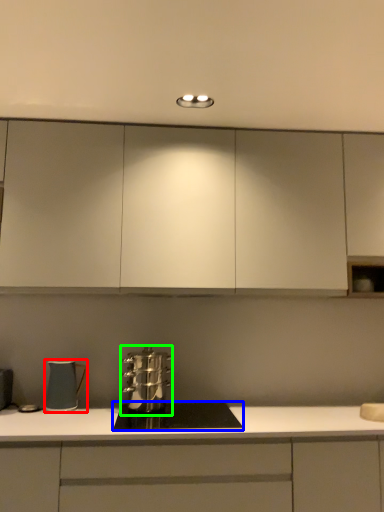
Question: Based on their relative distances, which object is nearer to kitchen appliance (highlighted by a red box)? Choose from home appliance (highlighted by a blue box) and kitchen appliance (highlighted by a green box).

Choices:
 (A) home appliance
 (B) kitchen appliance

Answer: (B)